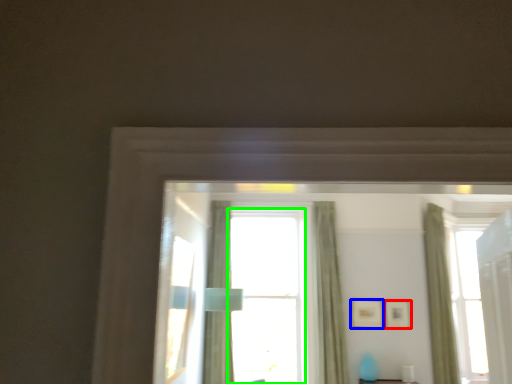
Question: Which object is the farthest from picture frame (highlighted by a red box)? Choose among these: picture frame (highlighted by a blue box) or window (highlighted by a green box).

Choices:
 (A) picture frame
 (B) window

Answer: (B)